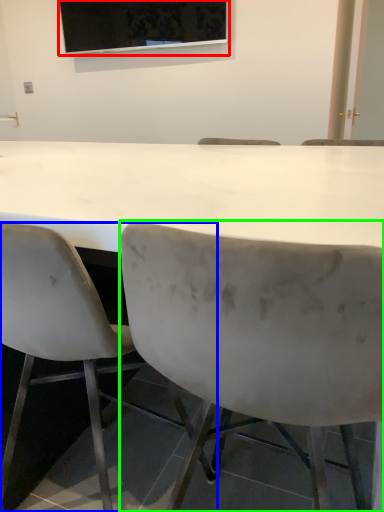
Question: Considering the real-world distances, which object is closest to projection screen (highlighted by a red box)? chair (highlighted by a blue box) or chair (highlighted by a green box).

Choices:
 (A) chair
 (B) chair

Answer: (A)